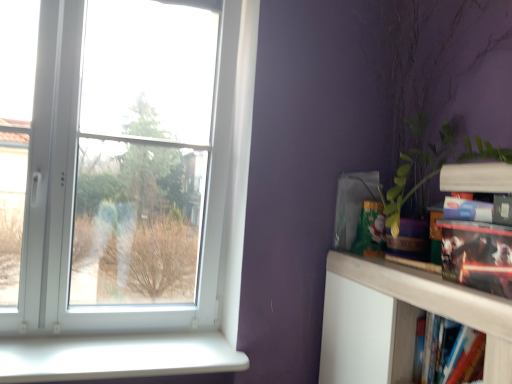
This screenshot has height=384, width=512. What are the coordinates of `vacant space underneath white plastic window at upper left (from a real-world perspective)` in the screenshot? It's located at (103, 334).